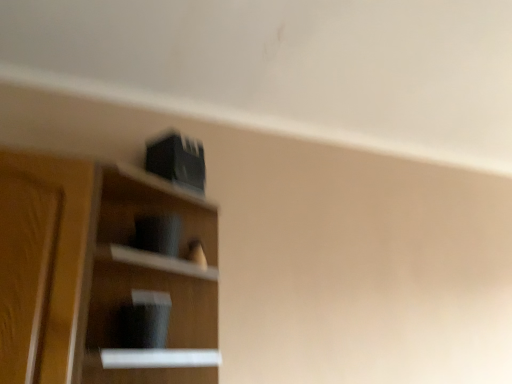
Identify the location of free space above black matte speaker at upper center (from a real-world perspective). (151, 189).